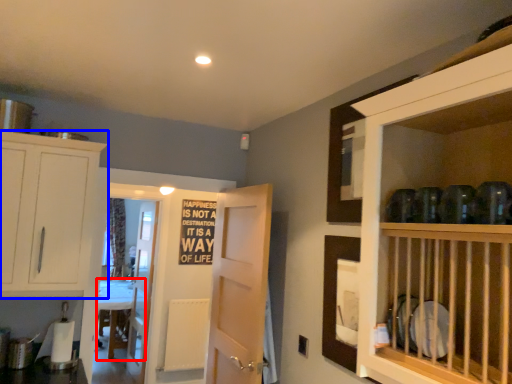
Question: Which object appears closest to the camera in this image, counter (highlighted by a red box) or cabinetry (highlighted by a blue box)?

Choices:
 (A) counter
 (B) cabinetry

Answer: (B)